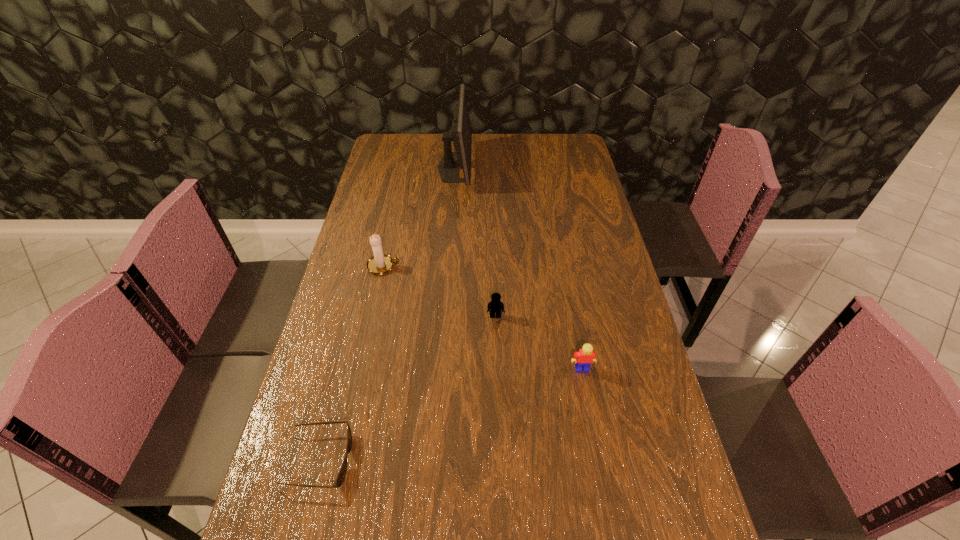
Where is `vacant space located 0.330m on the screen side of the third object from right to left`? The height and width of the screenshot is (540, 960). vacant space located 0.330m on the screen side of the third object from right to left is located at coordinates [554, 167].

Find the location of a particular element. free space located 0.300m on the handle side of the fourth shortest object is located at coordinates click(496, 266).

Locate an element on the screen. The width and height of the screenshot is (960, 540). blank area located on the front-facing side of the rightmost object is located at coordinates (589, 410).

Find the location of a particular element. Image resolution: width=960 pixels, height=540 pixels. free region located on the front-facing side of the fourth object from left to right is located at coordinates (498, 416).

Where is `vacant space located 0.140m on the lenses of the nearest object`? vacant space located 0.140m on the lenses of the nearest object is located at coordinates (415, 460).

Locate an element on the screen. This screenshot has width=960, height=540. object at the far edge is located at coordinates (461, 135).

Locate an element on the screen. The height and width of the screenshot is (540, 960). candle holder that is at the left edge is located at coordinates (380, 263).

Identify the location of sunglasses that is at the left edge. (340, 478).

What are the coordinates of `object that is at the right edge` in the screenshot? It's located at (584, 358).

Identify the location of blank space at the far edge of the desktop. This screenshot has height=540, width=960. (442, 145).